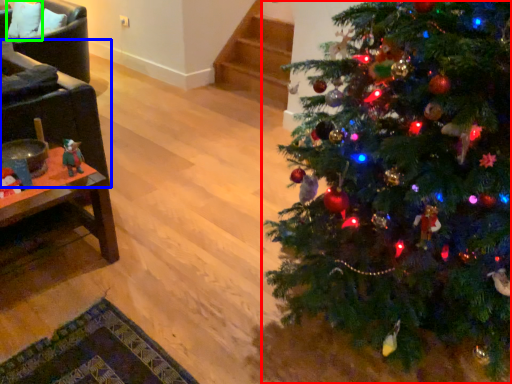
Question: Based on their relative distances, which object is farther from christmas tree (highlighted by a red box)? Choose from armchair (highlighted by a blue box) and pillow (highlighted by a green box).

Choices:
 (A) armchair
 (B) pillow

Answer: (B)